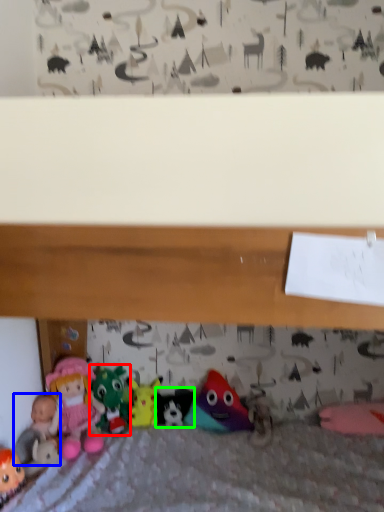
Question: Based on their relative distances, which object is farther from toy (highlighted by a red box)? Choose from toy (highlighted by a blue box) and toy (highlighted by a green box).

Choices:
 (A) toy
 (B) toy

Answer: (A)